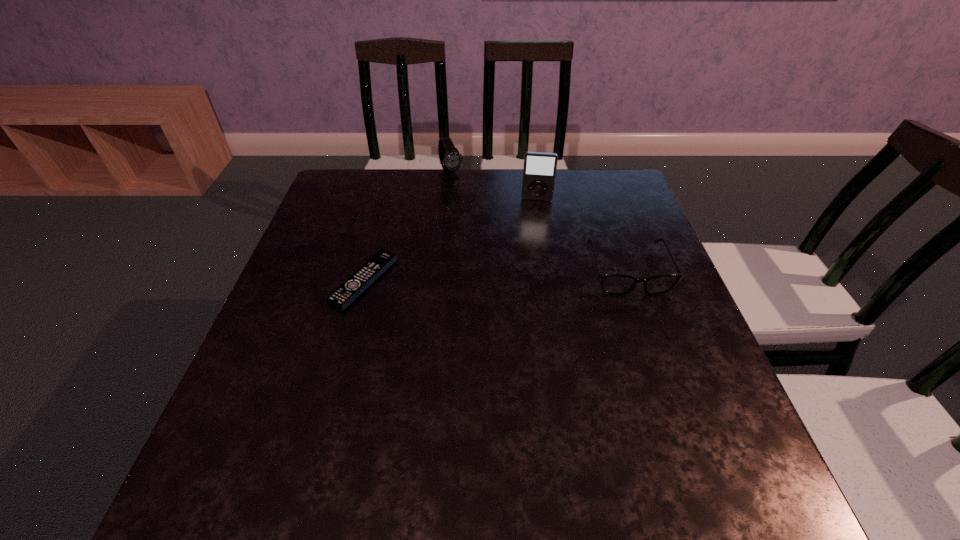
Identify the location of free space on the desktop that is between the remote control and the rightmost object and is positioned on the front-facing side of the iPod. The height and width of the screenshot is (540, 960). (533, 274).

The width and height of the screenshot is (960, 540). Identify the location of free space on the desktop that is between the remote control and the spectacles and is positioned on the face of the farthest object. (522, 275).